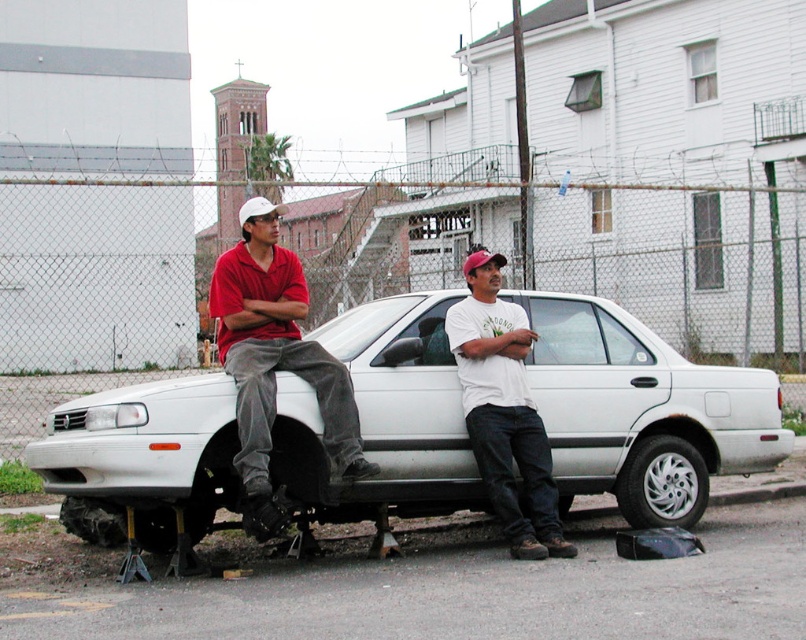
You are a photographer positioned to the left of the scene. You want to capture a photo that includes both the white matte sedan at center and the matte red shirt at left. Which direction should you move to ensure both subjects are in frame?

Since the white matte sedan at center is to the right of the matte red shirt at left, you should move to the left to include both subjects in your frame.

You are a delivery person trying to place a package between the matte red shirt at left and the white matte car at center. The package is 1.3 meters long. Can you fit it in the space between them?

The space between the matte red shirt at left and the white matte car at center is 1.24 meters, which is shorter than the package length of 1.3 meters. Therefore, the package cannot fit in the space between them.

You are a photographer at the scene. You need to capture a photo where both the white matte sedan at center and the matte red shirt at left are clearly visible. Given that the sedan is smaller than the shirt, where should you position yourself to ensure both are in frame?

Since the white matte sedan at center is smaller than the matte red shirt at left, you should position yourself closer to the sedan to ensure both objects are visible in the frame.